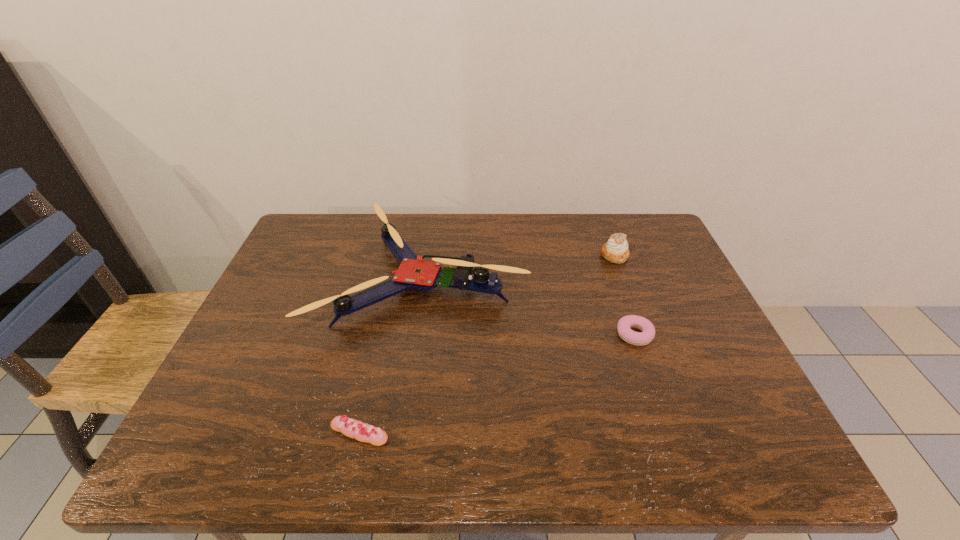
Where is `vacant space at the far right corner of the desktop`? This screenshot has height=540, width=960. vacant space at the far right corner of the desktop is located at coordinates (679, 259).

Image resolution: width=960 pixels, height=540 pixels. I want to click on free space between the eclair and the taller pastry, so click(x=487, y=344).

Identify the location of free spot between the nearer pastry and the nearest object. (497, 383).

You are a GUI agent. You are given a task and a screenshot of the screen. Output one action in this format:
    pyautogui.click(x=<x>, y=<y>)
    Task: Click on the vacant region between the taller pastry and the nearer pastry
    
    Given the screenshot: What is the action you would take?
    pyautogui.click(x=625, y=295)

Find the location of a particular element. vacant space that's between the drone and the second tallest object is located at coordinates (519, 266).

The image size is (960, 540). I want to click on free spot between the eclair and the shorter pastry, so click(497, 383).

What are the coordinates of `free space between the shorter pastry and the taller pastry` in the screenshot? It's located at (625, 295).

Identify the location of free space between the tallest object and the shorter pastry. (529, 306).

Identify the location of empty space between the nearest object and the drone. The width and height of the screenshot is (960, 540). (392, 355).

Find the location of `vacant region between the second tallest object and the tallest object`. vacant region between the second tallest object and the tallest object is located at coordinates (519, 266).